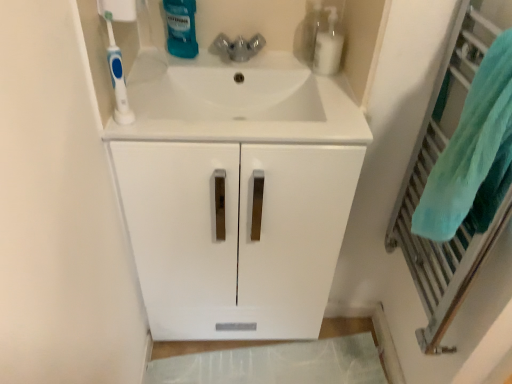
Locate an element on the screen. vacant space that is in between blue plastic toothbrush at upper left and translucent plastic mouthwash at upper center, the first cleaning product positioned from the left is located at coordinates (159, 81).